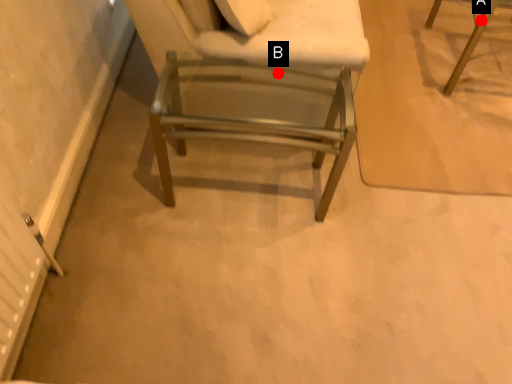
Question: Two points are circled on the image, labeled by A and B beside each circle. Among these points, which one is nearest to the camera?

Choices:
 (A) A is closer
 (B) B is closer

Answer: (B)